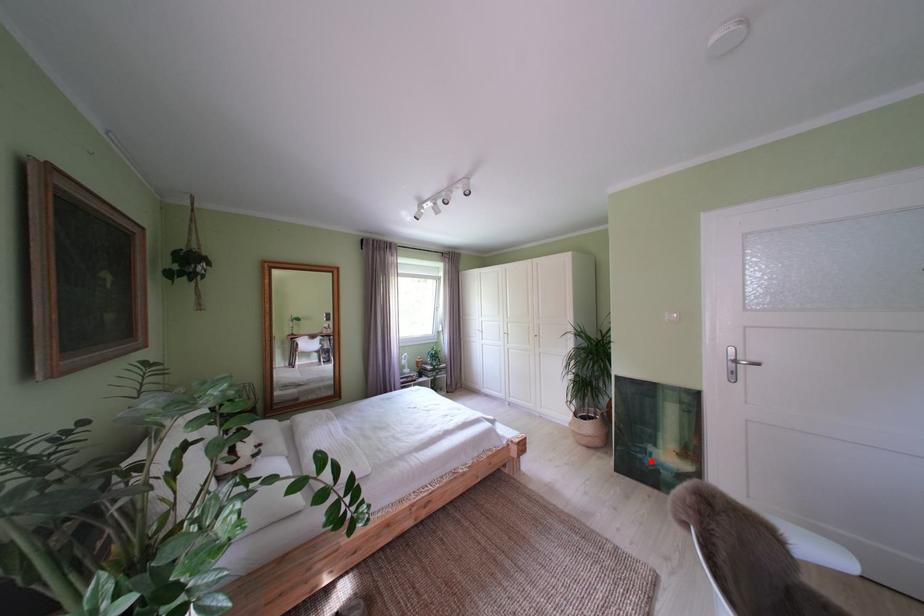
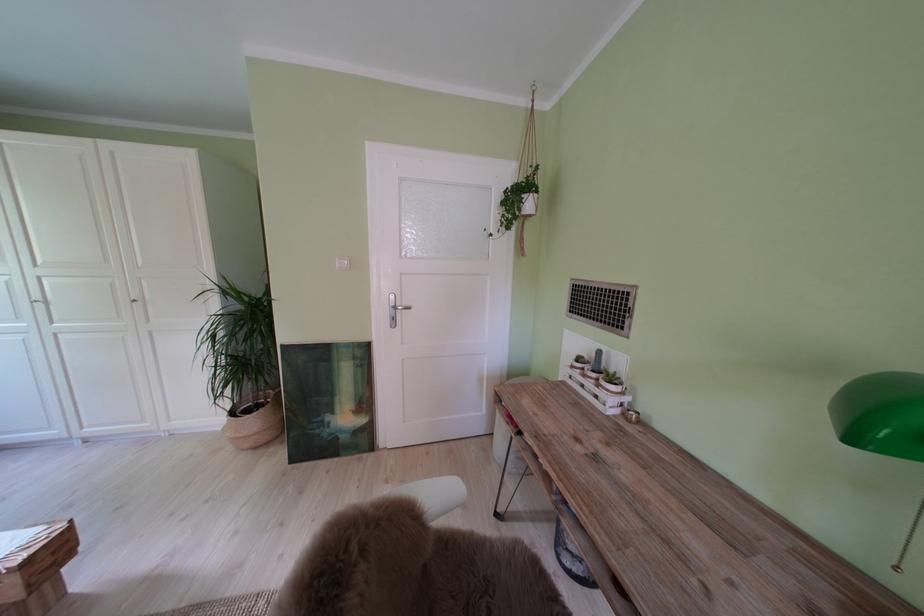
Question: I am providing you with two images of the same scene from different viewpoints. A red point is marked on the first image. Is the red point's position out of view in image 2?

Choices:
 (A) Yes
 (B) No

Answer: (B)